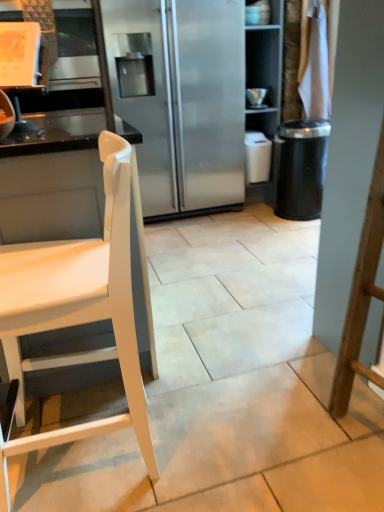
Where is `black textured trash can at right`? The width and height of the screenshot is (384, 512). black textured trash can at right is located at coordinates (301, 168).

Image resolution: width=384 pixels, height=512 pixels. What do you see at coordinates (301, 168) in the screenshot?
I see `black textured trash can at right` at bounding box center [301, 168].

I want to click on white matte chair at left, so click(x=77, y=311).

Measure the distance between white matte chair at left and camera.

white matte chair at left and camera are 34.19 inches apart.

What do you see at coordinates (77, 311) in the screenshot? Image resolution: width=384 pixels, height=512 pixels. I see `white matte chair at left` at bounding box center [77, 311].

At what (x,y) coordinates should I click in order to perform the action: click on black textured trash can at right. Please return your answer as a coordinate pair (x, y). The width and height of the screenshot is (384, 512). Looking at the image, I should click on (301, 168).

Is black textured trash can at right to the right of white matte chair at left from the viewer's perspective?

Correct, you'll find black textured trash can at right to the right of white matte chair at left.

Consider the image. Relative to white matte chair at left, is black textured trash can at right in front or behind?

black textured trash can at right is behind white matte chair at left.

Does point (324, 136) come closer to viewer compared to point (11, 344)?

No, (324, 136) is further to viewer.

From the image's perspective, is black textured trash can at right located above or below white matte chair at left?

Based on their image positions, black textured trash can at right is located above white matte chair at left.

From a real-world perspective, between black textured trash can at right and white matte chair at left, who is vertically lower?

black textured trash can at right, from a real-world perspective.

Consider the image. Between black textured trash can at right and white matte chair at left, which one has larger width?

Wider between the two is white matte chair at left.

Which of these two, black textured trash can at right or white matte chair at left, stands shorter?

black textured trash can at right is shorter.

From the picture: Does black textured trash can at right have a larger size compared to white matte chair at left?

Actually, black textured trash can at right might be smaller than white matte chair at left.

Is white matte chair at left surrounded by black textured trash can at right?

No, white matte chair at left is not a part of black textured trash can at right.

Can you see black textured trash can at right touching white matte chair at left?

No, black textured trash can at right is not touching white matte chair at left.

Consider the image. Is white matte chair at left at the back of black textured trash can at right?

No, black textured trash can at right is not facing the opposite direction of white matte chair at left.

How different are the orientations of black textured trash can at right and white matte chair at left in degrees?

1.6 degrees separate the facing orientations of black textured trash can at right and white matte chair at left.

The image size is (384, 512). Identify the location of chair lying in front of the black textured trash can at right. (77, 311).

Considering the positions of objects white matte chair at left and black textured trash can at right in the image provided, who is more to the left, white matte chair at left or black textured trash can at right?

white matte chair at left is more to the left.

Does white matte chair at left come in front of black textured trash can at right?

Yes, white matte chair at left is in front of black textured trash can at right.

Does point (129, 369) appear closer or farther from the camera than point (309, 197)?

Point (129, 369) appears to be closer to the viewer than point (309, 197).

Looking at this image, from the image's perspective, is white matte chair at left above or below black textured trash can at right?

white matte chair at left is situated lower than black textured trash can at right in the image.

From a real-world perspective, is white matte chair at left on top of black textured trash can at right?

Yes, from a real-world perspective, white matte chair at left is on top of black textured trash can at right.

Which of these two, white matte chair at left or black textured trash can at right, is thinner?

Thinner between the two is black textured trash can at right.

From their relative heights in the image, would you say white matte chair at left is taller or shorter than black textured trash can at right?

white matte chair at left is taller than black textured trash can at right.

Who is bigger, white matte chair at left or black textured trash can at right?

white matte chair at left is bigger.

From the picture: Is white matte chair at left not within black textured trash can at right?

That's correct, white matte chair at left is outside of black textured trash can at right.

Can you see white matte chair at left touching black textured trash can at right?

white matte chair at left and black textured trash can at right are not in contact.

Does white matte chair at left turn towards black textured trash can at right?

No, white matte chair at left is not turned towards black textured trash can at right.

Can you tell me how much white matte chair at left and black textured trash can at right differ in facing direction?

The facing directions of white matte chair at left and black textured trash can at right are 1.6 degrees apart.

At what (x,y) coordinates should I click in order to perform the action: click on chair below the black textured trash can at right (from the image's perspective). Please return your answer as a coordinate pair (x, y). The width and height of the screenshot is (384, 512). Looking at the image, I should click on (77, 311).

Locate an element on the screen. Image resolution: width=384 pixels, height=512 pixels. chair that is on the left side of black textured trash can at right is located at coordinates (x=77, y=311).

I want to click on chair above the black textured trash can at right (from a real-world perspective), so click(x=77, y=311).